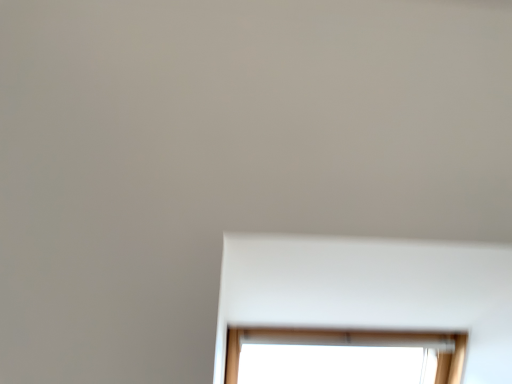
In order to face transparent glass window at center, should I rotate leftwards or rightwards?

To align with it, rotate right about 12.714°.

The image size is (512, 384). Describe the element at coordinates (343, 356) in the screenshot. I see `transparent glass window at center` at that location.

The image size is (512, 384). I want to click on transparent glass window at center, so click(343, 356).

What is the approximate height of transparent glass window at center?

The height of transparent glass window at center is 8.72 inches.

This screenshot has width=512, height=384. What do you see at coordinates (372, 291) in the screenshot?
I see `white matte bay window at lower center` at bounding box center [372, 291].

Measure the distance between point (311,283) and camera.

They are 1.00 meters apart.

In order to click on white matte bay window at lower center in this screenshot , I will do `click(372, 291)`.

Where is `transparent glass window at center`? transparent glass window at center is located at coordinates (343, 356).

In the scene shown: Between white matte bay window at lower center and transparent glass window at center, which one appears on the right side from the viewer's perspective?

white matte bay window at lower center.

Consider the image. Which object is closer to the camera taking this photo, white matte bay window at lower center or transparent glass window at center?

white matte bay window at lower center is in front.

Which is less distant, (362, 280) or (374, 370)?

Clearly, point (362, 280) is closer to the camera than point (374, 370).

From the image's perspective, which is below, white matte bay window at lower center or transparent glass window at center?

transparent glass window at center appears lower in the image.

From a real-world perspective, does white matte bay window at lower center sit lower than transparent glass window at center?

No.

Can you confirm if white matte bay window at lower center is thinner than transparent glass window at center?

No, white matte bay window at lower center is not thinner than transparent glass window at center.

Does white matte bay window at lower center have a greater height compared to transparent glass window at center?

Incorrect, the height of white matte bay window at lower center is not larger of that of transparent glass window at center.

Based on the photo, in terms of size, does white matte bay window at lower center appear bigger or smaller than transparent glass window at center?

Clearly, white matte bay window at lower center is smaller in size than transparent glass window at center.

Can we say white matte bay window at lower center lies outside transparent glass window at center?

white matte bay window at lower center lies outside transparent glass window at center's area.

Is white matte bay window at lower center next to transparent glass window at center and touching it?

white matte bay window at lower center is not next to transparent glass window at center, and they're not touching.

Is white matte bay window at lower center looking in the opposite direction of transparent glass window at center?

Yes, transparent glass window at center is at the back of white matte bay window at lower center.

What's the angular difference between white matte bay window at lower center and transparent glass window at center's facing directions?

There is a 0.0137-degree angle between the facing directions of white matte bay window at lower center and transparent glass window at center.

The image size is (512, 384). I want to click on bay window that is above the transparent glass window at center (from the image's perspective), so click(372, 291).

Is transparent glass window at center to the left or to the right of white matte bay window at lower center in the image?

Based on their positions, transparent glass window at center is located to the left of white matte bay window at lower center.

Considering the relative positions of transparent glass window at center and white matte bay window at lower center in the image provided, is transparent glass window at center behind white matte bay window at lower center?

Yes, transparent glass window at center is further from the viewer.

Which is behind, point (419, 339) or point (472, 342)?

Positioned behind is point (419, 339).

From the image's perspective, between transparent glass window at center and white matte bay window at lower center, which one is located above?

white matte bay window at lower center.

From a real-world perspective, is transparent glass window at center above or below white matte bay window at lower center?

transparent glass window at center is situated lower than white matte bay window at lower center in the real world.

Considering the sizes of objects transparent glass window at center and white matte bay window at lower center in the image provided, who is thinner, transparent glass window at center or white matte bay window at lower center?

transparent glass window at center is thinner.

Who is taller, transparent glass window at center or white matte bay window at lower center?

Standing taller between the two is transparent glass window at center.

From the picture: Between transparent glass window at center and white matte bay window at lower center, which one has larger size?

With larger size is transparent glass window at center.

Is transparent glass window at center not inside white matte bay window at lower center?

Indeed, transparent glass window at center is completely outside white matte bay window at lower center.

Is transparent glass window at center far away from white matte bay window at lower center?

That's not correct — transparent glass window at center is a little close to white matte bay window at lower center.

In the scene shown: Is transparent glass window at center facing towards white matte bay window at lower center?

Yes, transparent glass window at center is turned towards white matte bay window at lower center.

Can you tell me how much transparent glass window at center and white matte bay window at lower center differ in facing direction?

The facing directions of transparent glass window at center and white matte bay window at lower center are 0.0137 degrees apart.

How far apart are transparent glass window at center and white matte bay window at lower center?

transparent glass window at center is 93.11 centimeters from white matte bay window at lower center.

Locate an element on the screen. The width and height of the screenshot is (512, 384). bay window lying above the transparent glass window at center (from the image's perspective) is located at coordinates pyautogui.click(x=372, y=291).

Find the location of a particular element. bay window on the right of the transparent glass window at center is located at coordinates (372, 291).

You are a GUI agent. You are given a task and a screenshot of the screen. Output one action in this format:
    pyautogui.click(x=<x>, y=<y>)
    Task: Click on the bay window that is in front of the transparent glass window at center
    This screenshot has height=384, width=512.
    Given the screenshot: What is the action you would take?
    pyautogui.click(x=372, y=291)